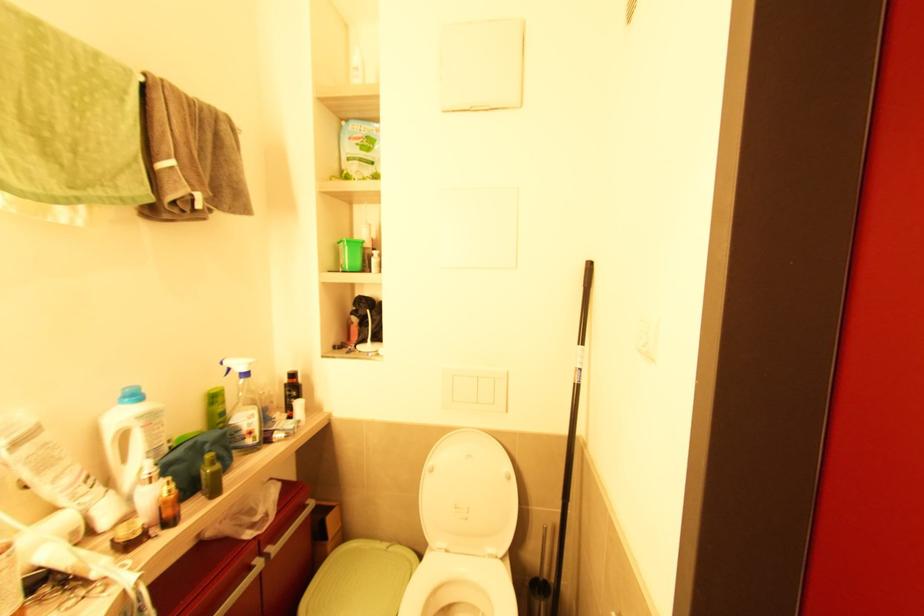
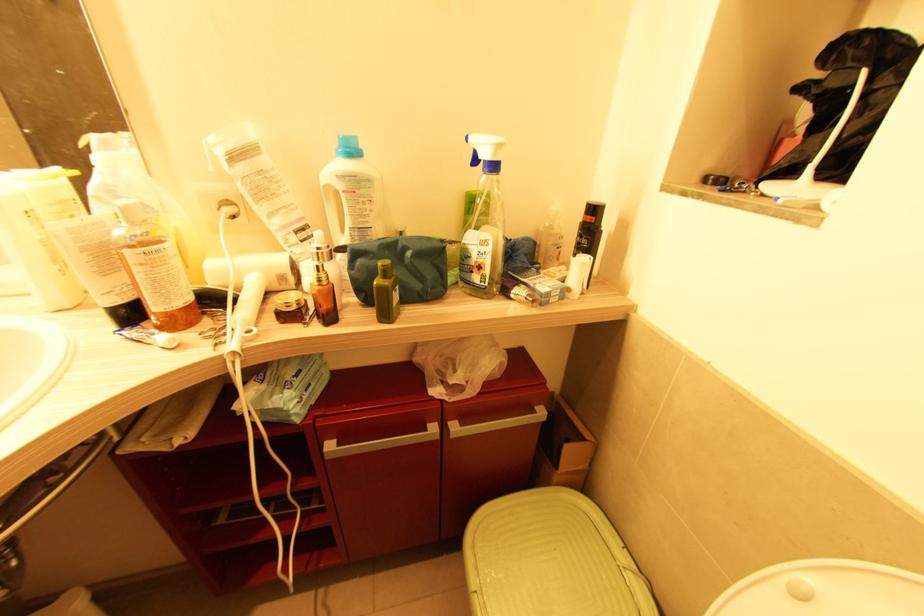
Question: I am providing you with two images of the same scene from different viewpoints. Which of the following objects are not visible in image2?

Choices:
 (A) silver cabinet handle
 (B) green trash can lid
 (C) green toiletry bag
 (D) none of these

Answer: (D)